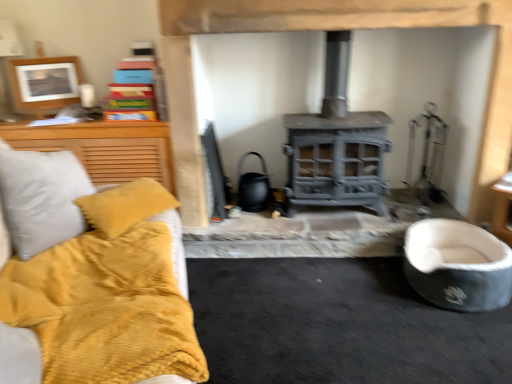
You are a GUI agent. You are given a task and a screenshot of the screen. Output one action in this format:
    pyautogui.click(x=<x>, y=<y>)
    Task: Click on the space that is in front of soft gray fabric pet bed at lower right
    The height and width of the screenshot is (384, 512).
    Given the screenshot: What is the action you would take?
    pyautogui.click(x=456, y=342)